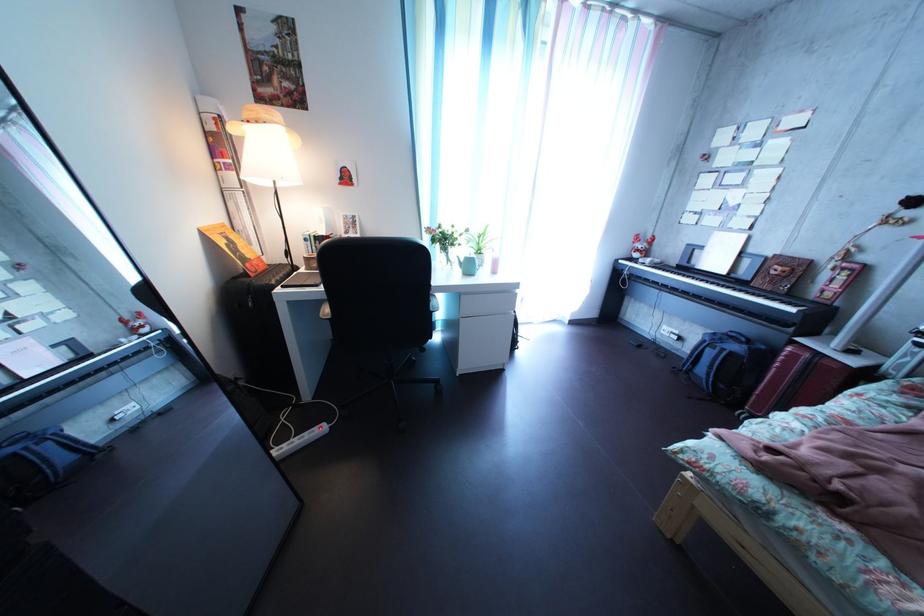
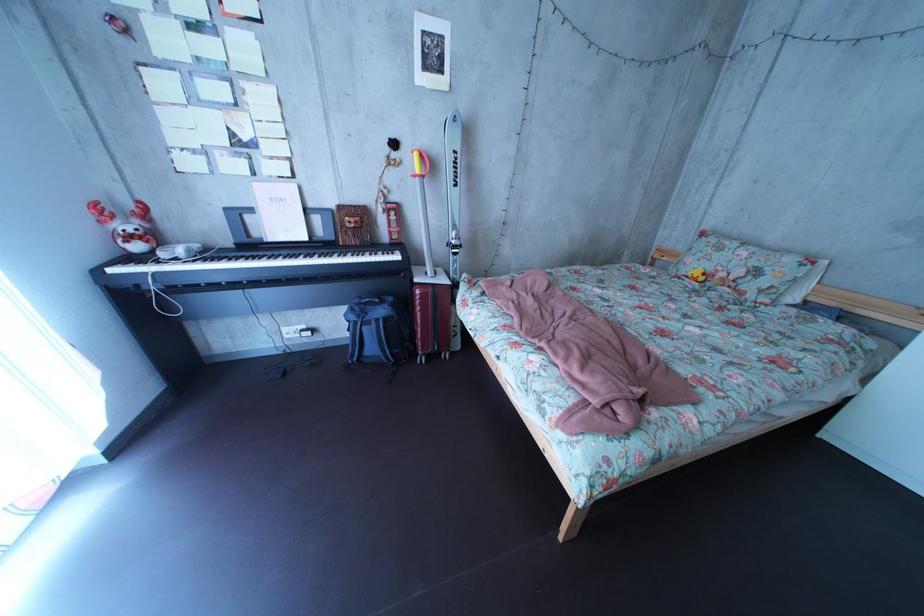
Locate, in the second image, the point that corresponds to [795,277] in the first image.

(367, 228)